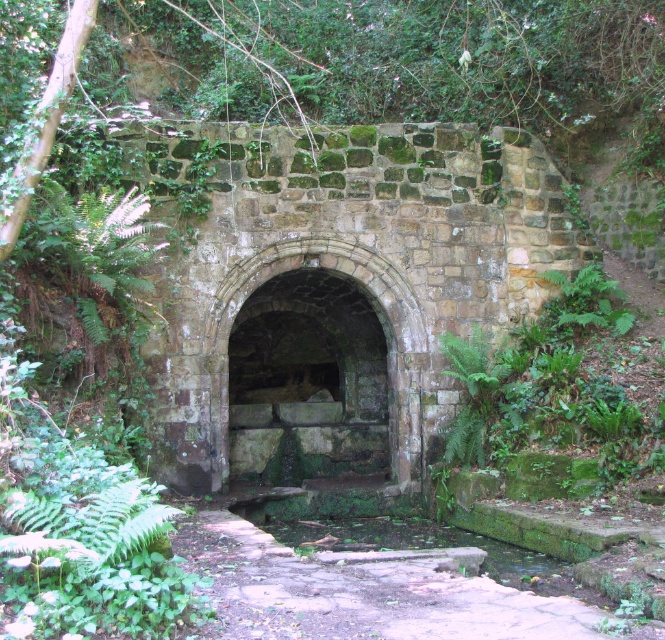
Can you confirm if green mossy stone arch at center is bigger than mossy stone path at center?

Incorrect, green mossy stone arch at center is not larger than mossy stone path at center.

Does point (331, 458) lie behind point (434, 556)?

That is True.

Identify the location of green mossy stone arch at center. (317, 369).